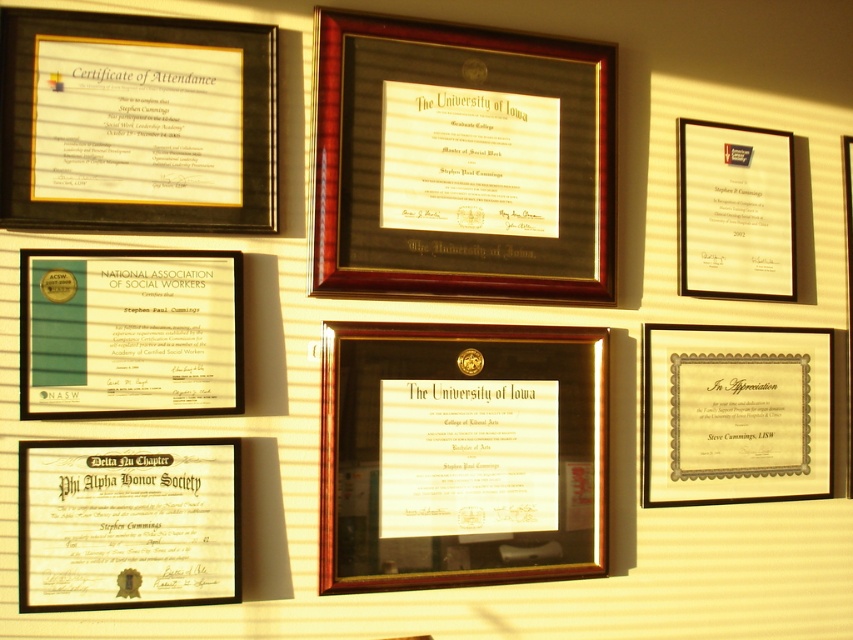
You are an interior designer planning to hang a new decorative item between the green paper certificate at lower left and the matte black certificate at upper right. The item requires at least 30 inches of space to look balanced. Based on the current arrangement, will there be enough space?

The distance between the green paper certificate at lower left and the matte black certificate at upper right is 27.88 inches. Since the required space is 30 inches, there isn not enough space to place the new item between them.

Which object is located at point (x=131, y=333)?

The green paper certificate at lower left is located at point (x=131, y=333).